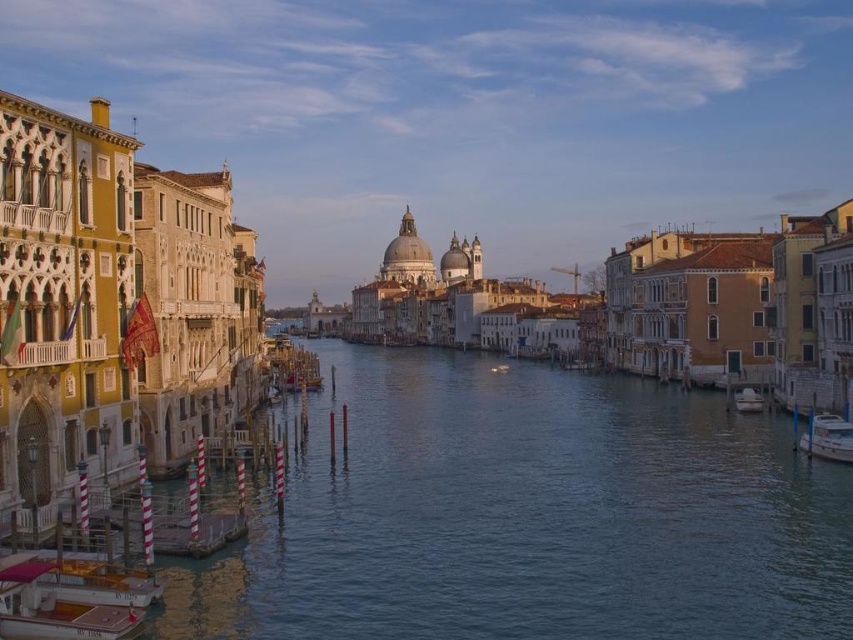
Is wooden polished boat at lower left to the left of white glossy boat at right from the viewer's perspective?

Indeed, wooden polished boat at lower left is positioned on the left side of white glossy boat at right.

Which is in front, point (22, 592) or point (843, 433)?

Point (22, 592) is in front.

Is point (19, 605) closer to camera compared to point (834, 426)?

Yes, it is in front of point (834, 426).

Find the location of a particular element. This screenshot has height=640, width=853. wooden polished boat at lower left is located at coordinates (56, 605).

Which is below, wooden polished boat at lower left or white glossy boat at lower right?

wooden polished boat at lower left is below.

Is point (97, 604) in front of point (735, 396)?

Yes, point (97, 604) is in front of point (735, 396).

Measure the distance between wooden polished boat at lower left and camera.

wooden polished boat at lower left is 43.05 meters from camera.

The width and height of the screenshot is (853, 640). I want to click on wooden polished boat at lower left, so click(56, 605).

Does white glossy boat at right lie behind white glossy boat at lower right?

No.

Is point (849, 444) positioned before point (757, 392)?

Yes, it is in front of point (757, 392).

Where is `white glossy boat at right`? white glossy boat at right is located at coordinates (x=827, y=436).